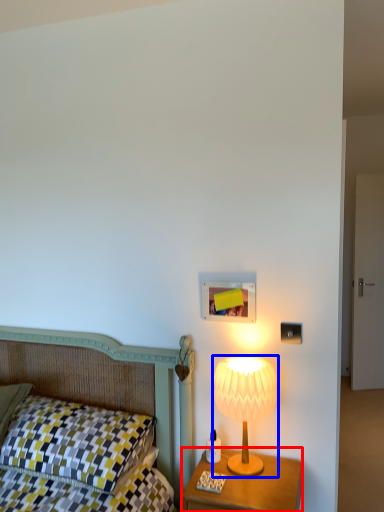
Question: Which object appears farthest to the camera in this image, nightstand (highlighted by a red box) or lamp (highlighted by a blue box)?

Choices:
 (A) nightstand
 (B) lamp

Answer: (B)